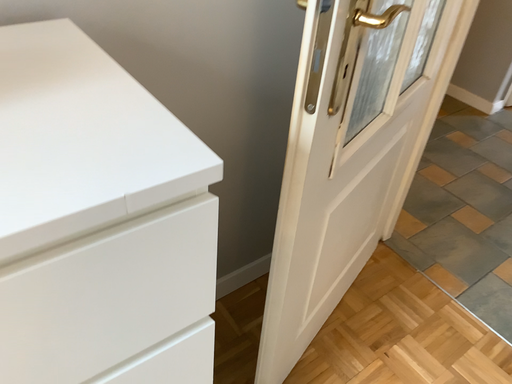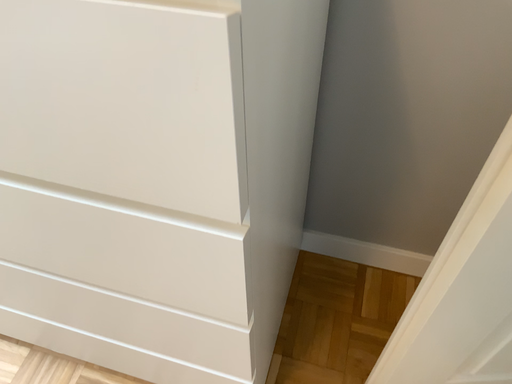
Question: How did the camera likely rotate when shooting the video?

Choices:
 (A) rotated left
 (B) rotated right

Answer: (A)